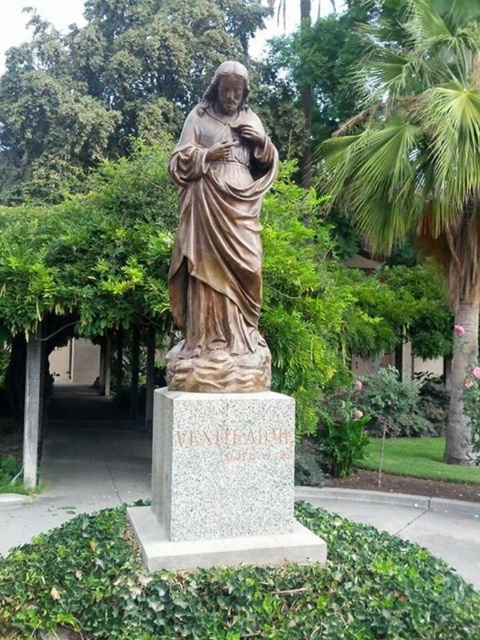
You are standing in the landscaped area and want to take a photo of the bronze statue at center without any obstructions. Is the green leafy palm tree at center right blocking the view of the statue?

The green leafy palm tree at center right is larger than the bronze statue at center, so it might block the view depending on the angle and distance. To ensure an unobstructed photo, position yourself where the statue is not behind the palm tree.

You are a maintenance worker who needs to water the green leafy palm tree at center right. You are currently standing next to the bronze statue at center. Do you have enough space to move the watering equipment to the palm tree without hitting the statue?

The distance between the green leafy palm tree at center right and the bronze statue at center is 5.91 meters, which should provide ample space for moving the watering equipment without any obstruction from the statue.

You are standing in the landscaped area and want to take a photo of the bronze statue at center without any obstructions. Since the green leafy palm tree at center right is blocking your view, can you move to the left to get a clear shot?

The bronze statue at center is behind the green leafy palm tree at center right, so moving to the left might allow you to position yourself where the palm tree is no longer blocking the view of the statue.